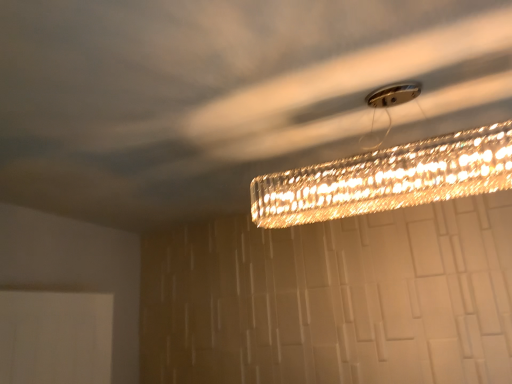
Where is `crystal glass chandelier at upper center`? The width and height of the screenshot is (512, 384). crystal glass chandelier at upper center is located at coordinates (387, 178).

The width and height of the screenshot is (512, 384). Describe the element at coordinates (387, 178) in the screenshot. I see `crystal glass chandelier at upper center` at that location.

You are a GUI agent. You are given a task and a screenshot of the screen. Output one action in this format:
    pyautogui.click(x=<x>, y=<y>)
    Task: Click on the crystal glass chandelier at upper center
    
    Given the screenshot: What is the action you would take?
    pyautogui.click(x=387, y=178)